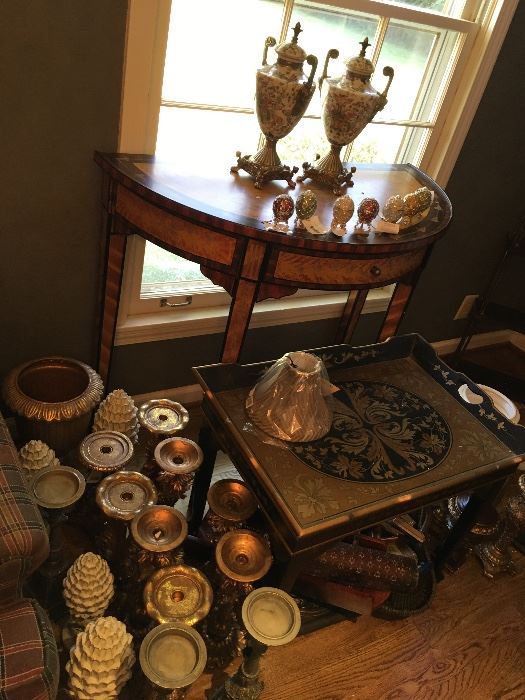
In order to click on floor in this screenshot , I will do `click(430, 663)`.